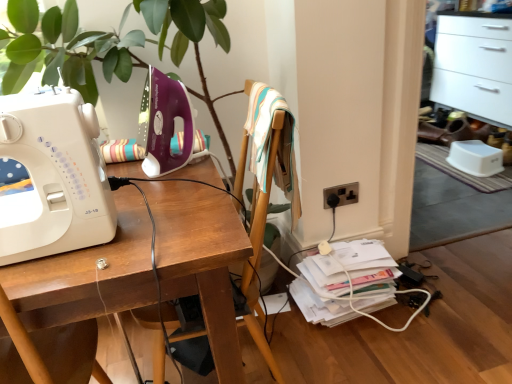
Find the location of a particular element. The height and width of the screenshot is (384, 512). spots to the right of white plastic sewing machine at left, the 2th sewing machine viewed from the back is located at coordinates (155, 222).